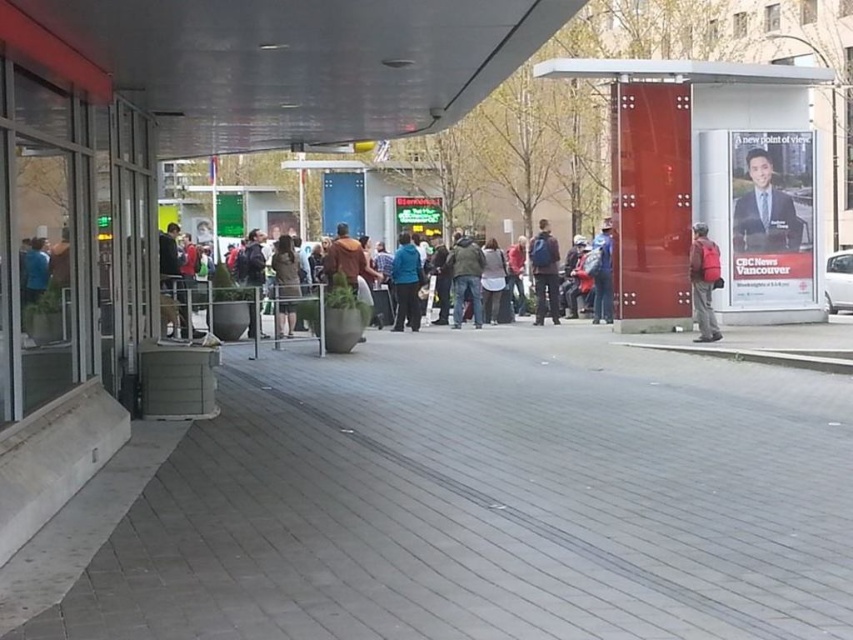
Question: Which point is farther to the camera?

Choices:
 (A) (553, 273)
 (B) (579, 579)
 (C) (693, 308)
 (D) (492, 276)

Answer: (D)

Question: Can you confirm if dark brown leather jacket at center is bigger than teal fabric jacket at center?

Choices:
 (A) yes
 (B) no

Answer: (A)

Question: Which object is closer to the camera taking this photo?

Choices:
 (A) brown leather jacket at center
 (B) white matte jacket at center
 (C) matte red backpack at right

Answer: (A)

Question: Is matte red backpack at right below brown leather jacket at center?

Choices:
 (A) no
 (B) yes

Answer: (B)

Question: Which of these objects is positioned farthest from the smooth suit at center?

Choices:
 (A) gray concrete pavement at center
 (B) dark brown leather jacket at center
 (C) matte red backpack at right
 (D) denim jacket at center

Answer: (A)

Question: Does shiny red bus stop at center right appear over brown leather jacket at center?

Choices:
 (A) yes
 (B) no

Answer: (A)